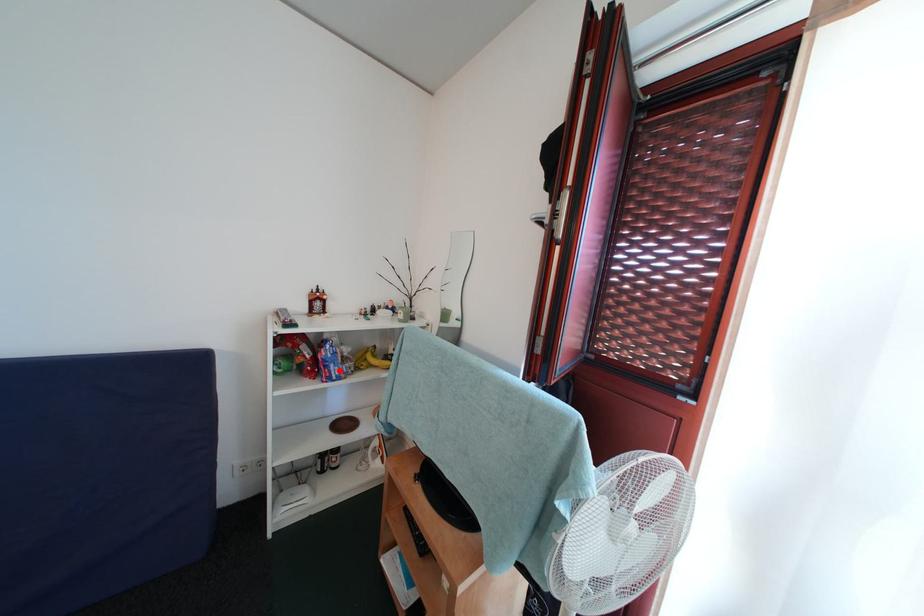
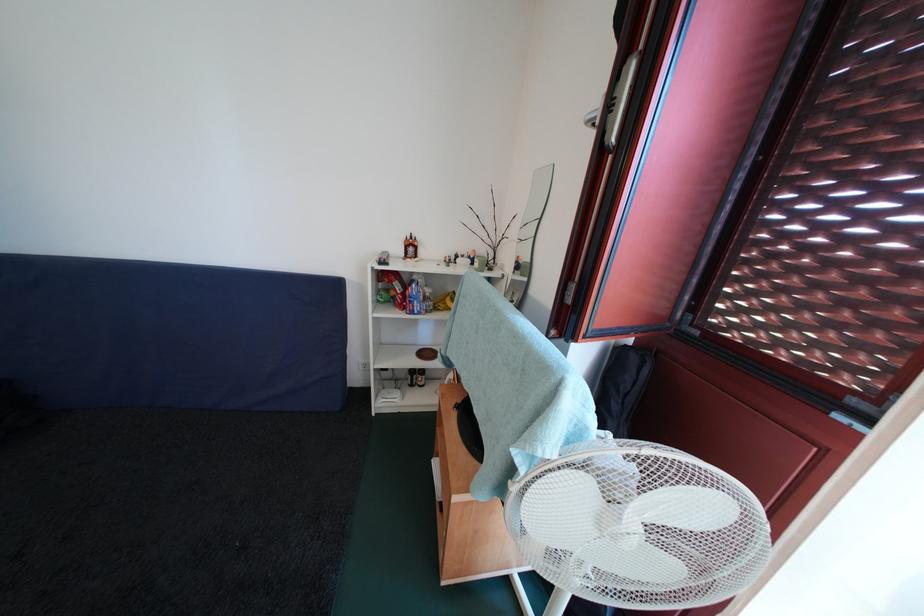
Where in the second image is the point corresponding to the highlighted location from the first image?

(422, 307)